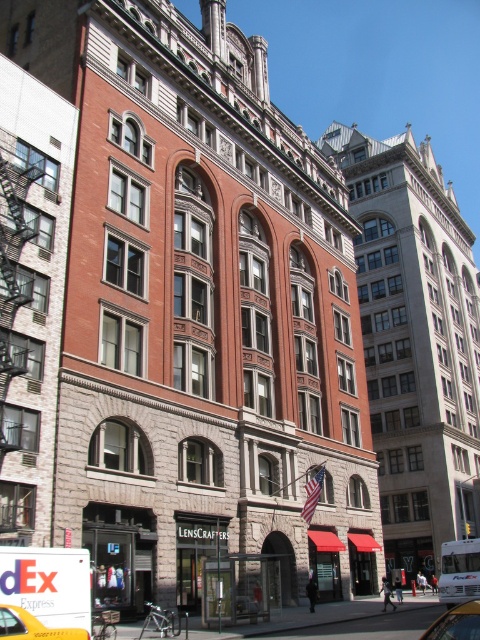
You are a delivery person needing to park a van that is 20 feet long. You see the yellow rubber taxi at lower left and the metallic silver car at lower right. Can you park your van between them without moving either vehicle?

The yellow rubber taxi at lower left and metallic silver car at lower right are 42.33 feet apart, so yes, the van can be parked between them since the distance is greater than the van length of 20 feet.

You are a delivery person needing to park a van that is 6 meters long. You see the yellow rubber taxi at lower left and the metallic silver car at lower right parked on the street. Based on their sizes, can you estimate if there is enough space between them to park your van?

The yellow rubber taxi at lower left is smaller than the metallic silver car at lower right. However, without knowing the exact distance between them or the total available space, it is impossible to determine if there is enough room for a 6 meter van. Please check the actual space between the two vehicles.